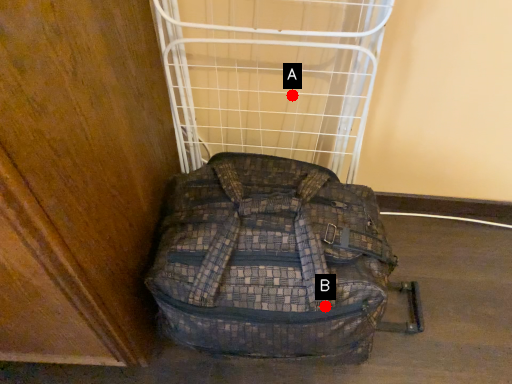
Question: Two points are circled on the image, labeled by A and B beside each circle. Which point is closer to the camera?

Choices:
 (A) A is closer
 (B) B is closer

Answer: (B)